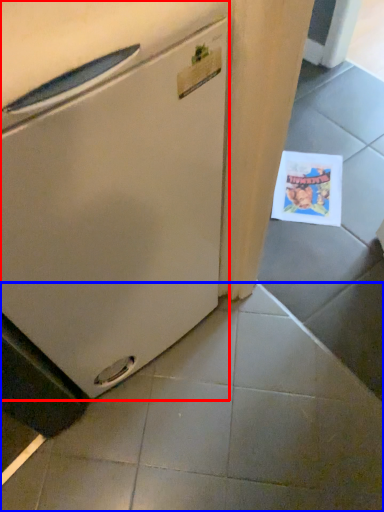
Question: Which object is closer to the camera taking this photo, refrigerator (highlighted by a red box) or tile (highlighted by a blue box)?

Choices:
 (A) refrigerator
 (B) tile

Answer: (A)